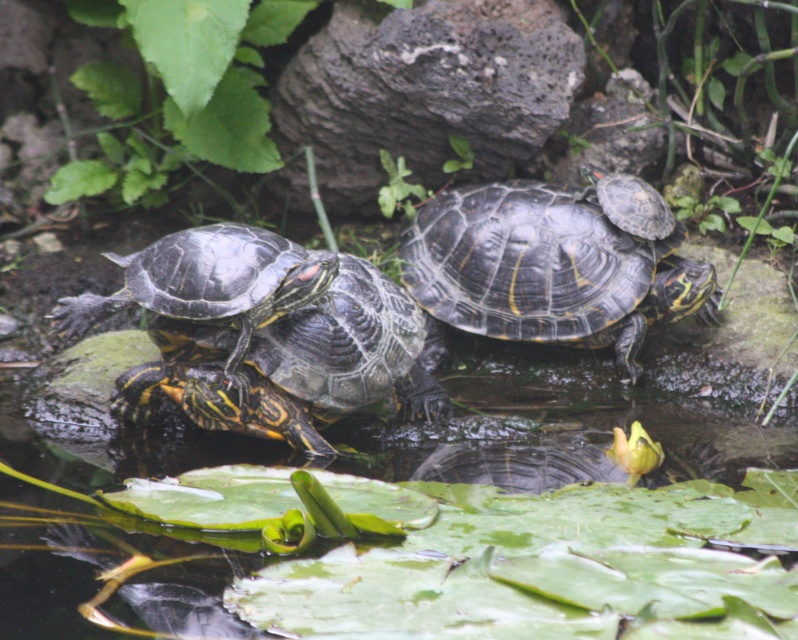
Between point (619, 241) and point (214, 324), which one is positioned in front?

Point (214, 324) is more forward.

Can you confirm if shiny black turtle at center is smaller than shiny dark green tortoise at center?

No.

Between point (512, 241) and point (101, 308), which one is positioned behind?

Positioned behind is point (512, 241).

Locate an element on the screen. The image size is (798, 640). shiny black turtle at center is located at coordinates (555, 262).